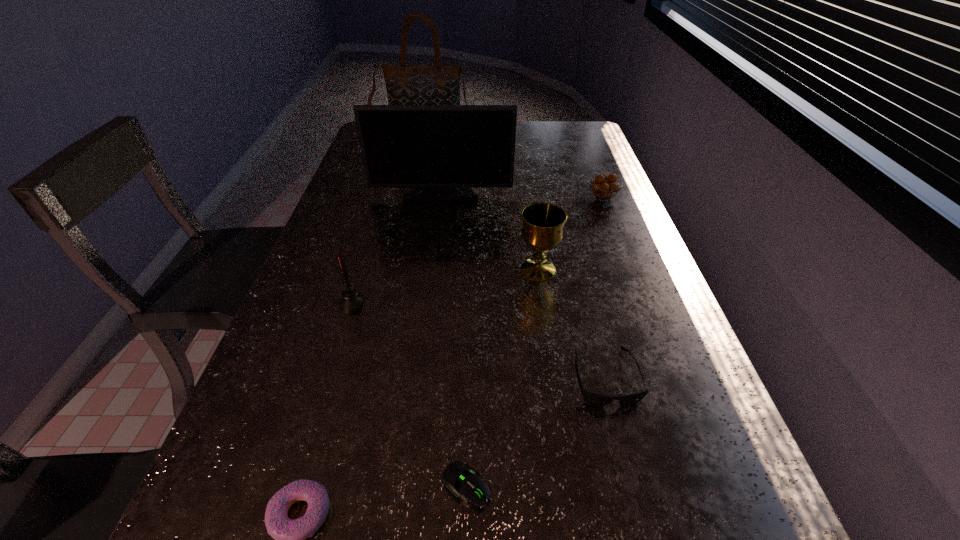
The image size is (960, 540). Find the location of `orange fruit that is at the right edge`. orange fruit that is at the right edge is located at coordinates (602, 189).

Where is `sunglasses that is at the right edge`? sunglasses that is at the right edge is located at coordinates (592, 398).

You are a GUI agent. You are given a task and a screenshot of the screen. Output one action in this format:
    pyautogui.click(x=<x>, y=<y>)
    Task: Click on the object present at the far left corner
    
    Given the screenshot: What is the action you would take?
    pyautogui.click(x=439, y=84)

I want to click on free space at the left edge, so click(x=282, y=479).

In the image, there is a desktop. Where is `free space at the right edge`? The width and height of the screenshot is (960, 540). free space at the right edge is located at coordinates (614, 228).

Image resolution: width=960 pixels, height=540 pixels. I want to click on unoccupied position between the chalice and the seventh shortest object, so click(x=490, y=231).

Where is `free area in between the sunglasses and the shortest object`? This screenshot has height=540, width=960. free area in between the sunglasses and the shortest object is located at coordinates (536, 431).

The width and height of the screenshot is (960, 540). In order to click on vacant area between the fifth tallest object and the fourth nearest object in this screenshot , I will do `click(477, 249)`.

Identify the location of free space between the fourth nearest object and the shortest object. Image resolution: width=960 pixels, height=540 pixels. 409,394.

The width and height of the screenshot is (960, 540). I want to click on free space between the tallest object and the sunglasses, so click(x=515, y=255).